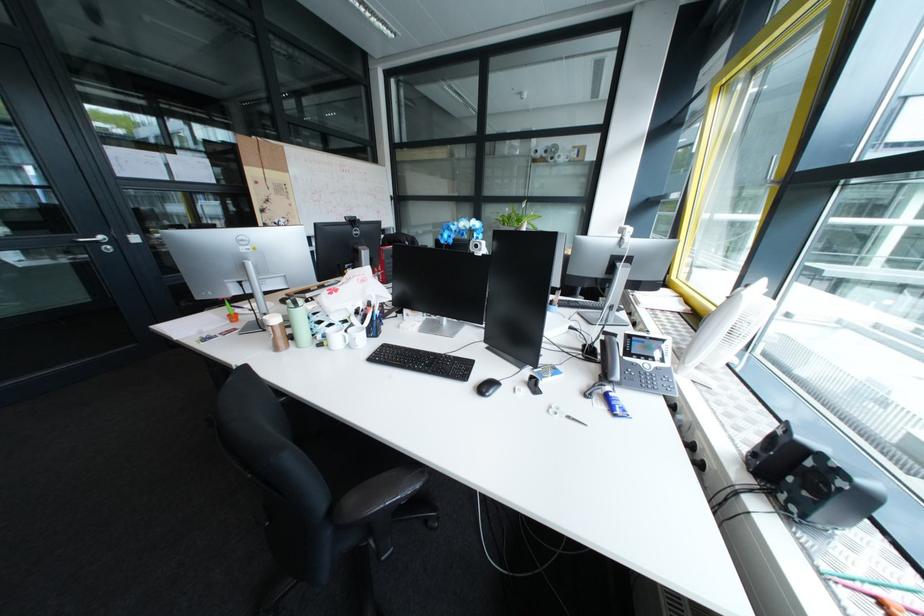
Where would you squeez the blue cream tube? Please return your answer as a coordinate pair (x, y).

(298, 322)